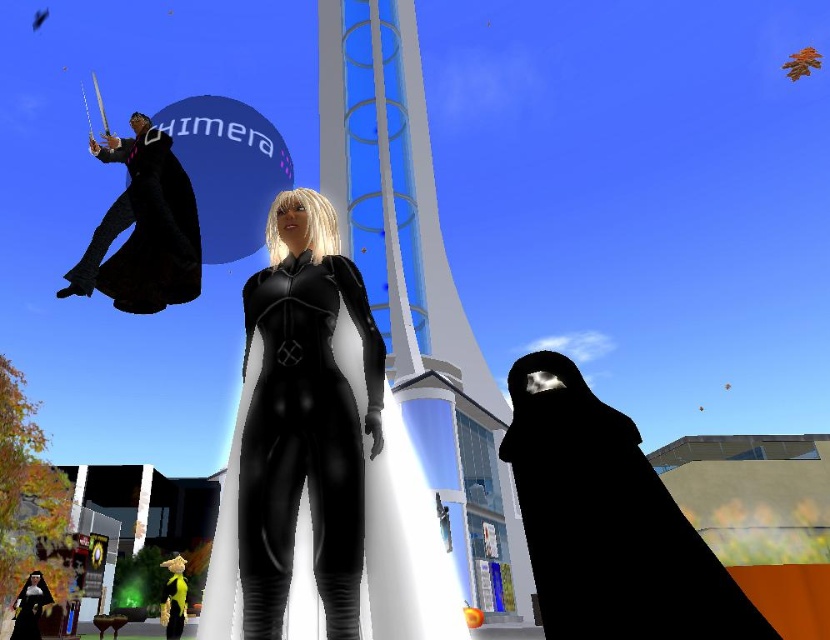
You are navigating through a virtual environment and need to reach a checkpoint located at point (262, 504). There is an obstacle at point (147, 120). Will the obstacle block your path to the checkpoint?

Point (262, 504) is in front of point (147, 120), so the obstacle at point (147, 120) will not block your path to the checkpoint.

You are a character in this scene and want to hand an item to both the matte black bodysuit at center and the matte black robe at upper left. Which one should you approach first to reach them in the shortest path?

You should approach the matte black bodysuit at center first because it is closer to the viewer than the matte black robe at upper left, so the shortest path would be to reach it first.